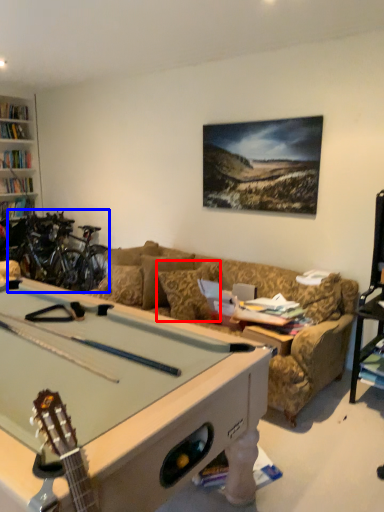
Question: Among these objects, which one is nearest to the camera, pillow (highlighted by a red box) or bicycle (highlighted by a blue box)?

Choices:
 (A) pillow
 (B) bicycle

Answer: (A)